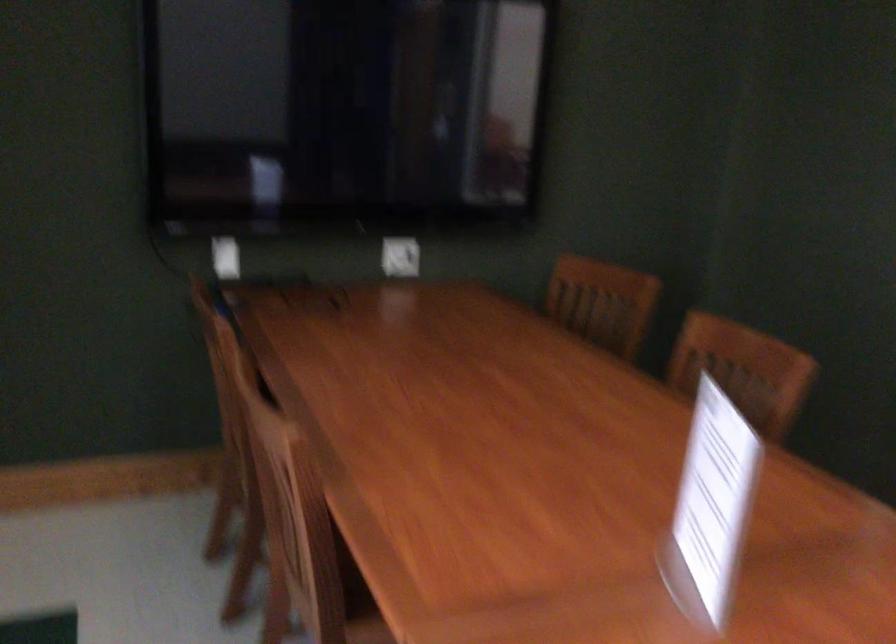
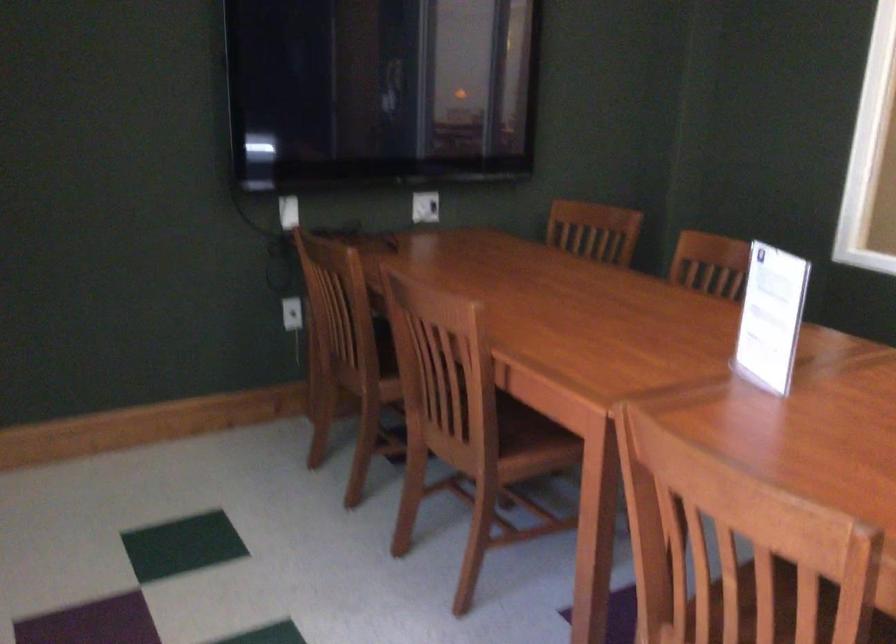
Question: The images are taken continuously from a first-person perspective. In which direction is your viewpoint rotating?

Choices:
 (A) Left
 (B) Right
 (C) Up
 (D) Down

Answer: (B)